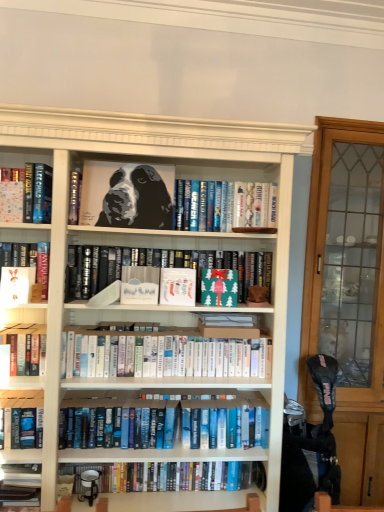
The image size is (384, 512). What do you see at coordinates (174, 201) in the screenshot?
I see `black matte portrait at upper center, which is the 7th book in bottom-to-top order` at bounding box center [174, 201].

Identify the location of white matte paper at left, the 4th paperback book in the right-to-left sequence. Image resolution: width=384 pixels, height=512 pixels. (16, 285).

The image size is (384, 512). What do you see at coordinates (21, 398) in the screenshot?
I see `hardcover book at lower left, the fifth book when ordered from top to bottom` at bounding box center [21, 398].

What is the approximate height of hardcover book at lower left, the fifth book when ordered from top to bottom?

hardcover book at lower left, the fifth book when ordered from top to bottom, is 9.60 inches in height.

Image resolution: width=384 pixels, height=512 pixels. Identify the location of hardcover book at left, which is the second book from top to bottom. (37, 193).

Locate an element on the screen. This screenshot has width=384, height=512. black matte portrait at upper center, which is the 7th book in bottom-to-top order is located at coordinates (174, 201).

Considering the positions of objects green paper at center, which is the 1th paperback book from right to left, and white matte paper at center, which is the third paperback book from left to right, in the image provided, who is more to the left, green paper at center, which is the 1th paperback book from right to left, or white matte paper at center, which is the third paperback book from left to right,?

From the viewer's perspective, white matte paper at center, which is the third paperback book from left to right, appears more on the left side.

You are a GUI agent. You are given a task and a screenshot of the screen. Output one action in this format:
    pyautogui.click(x=<x>, y=<y>)
    Task: Click on the 2nd paperback book behind the white matte paper at center, which is the third paperback book from left to right
    Image resolution: width=384 pixels, height=512 pixels.
    Given the screenshot: What is the action you would take?
    pyautogui.click(x=219, y=287)

Is green paper at center, which ranks as the fifth paperback book in left-to-right order, in front of white matte paper at center, which is the third paperback book from left to right?

No, it is behind white matte paper at center, which is the third paperback book from left to right.

Is green paper at center, which is the 1th paperback book from right to left, positioned with its back to white matte paper at center, the 3th paperback book positioned from the right?

No, green paper at center, which is the 1th paperback book from right to left,'s orientation is not away from white matte paper at center, the 3th paperback book positioned from the right.

From the picture: Between blue hardcover books at center, placed as the second book when sorted from bottom to top, and matte black book at center, placed as the 3th book when sorted from top to bottom, which one has less height?

Standing shorter between the two is blue hardcover books at center, placed as the second book when sorted from bottom to top.

Considering the relative sizes of blue hardcover books at center, which appears as the sixth book when viewed from the top, and matte black book at center, the 5th book in the bottom-to-top sequence, in the image provided, is blue hardcover books at center, which appears as the sixth book when viewed from the top, bigger than matte black book at center, the 5th book in the bottom-to-top sequence,?

Correct, blue hardcover books at center, which appears as the sixth book when viewed from the top, is larger in size than matte black book at center, the 5th book in the bottom-to-top sequence.

Is blue hardcover books at center, placed as the second book when sorted from bottom to top, at the right side of matte black book at center, the 5th book in the bottom-to-top sequence?

In fact, blue hardcover books at center, placed as the second book when sorted from bottom to top, is to the left of matte black book at center, the 5th book in the bottom-to-top sequence.

From the image's perspective, which is above, blue hardcover books at center, placed as the second book when sorted from bottom to top, or matte black book at center, placed as the 3th book when sorted from top to bottom?

matte black book at center, placed as the 3th book when sorted from top to bottom, appears higher in the image.

Are matte black book at center, the 5th book in the bottom-to-top sequence, and matte paper book at left, which ranks as the 1th paperback book in left-to-right order, beside each other?

There is a gap between matte black book at center, the 5th book in the bottom-to-top sequence, and matte paper book at left, which ranks as the 1th paperback book in left-to-right order.

Is matte black book at center, placed as the 3th book when sorted from top to bottom, turned away from matte paper book at left, placed as the fifth paperback book when sorted from right to left?

No, matte black book at center, placed as the 3th book when sorted from top to bottom, is not facing away from matte paper book at left, placed as the fifth paperback book when sorted from right to left.

Between matte black book at center, placed as the 3th book when sorted from top to bottom, and matte paper book at left, placed as the fifth paperback book when sorted from right to left, which one has smaller size?

With smaller size is matte paper book at left, placed as the fifth paperback book when sorted from right to left.

Can you confirm if matte black book at center, placed as the 3th book when sorted from top to bottom, is positioned to the right of matte paper book at left, placed as the fifth paperback book when sorted from right to left?

Indeed, matte black book at center, placed as the 3th book when sorted from top to bottom, is positioned on the right side of matte paper book at left, placed as the fifth paperback book when sorted from right to left.

Which of these two, clear glass cabinet at right or matte paper book at left, placed as the fifth paperback book when sorted from right to left, stands taller?

With more height is clear glass cabinet at right.

Considering the relative positions of clear glass cabinet at right and matte paper book at left, which ranks as the 1th paperback book in left-to-right order, in the image provided, is clear glass cabinet at right to the left of matte paper book at left, which ranks as the 1th paperback book in left-to-right order, from the viewer's perspective?

No, clear glass cabinet at right is not to the left of matte paper book at left, which ranks as the 1th paperback book in left-to-right order.

From a real-world perspective, is clear glass cabinet at right on matte paper book at left, placed as the fifth paperback book when sorted from right to left?

Incorrect, from a real-world perspective, clear glass cabinet at right is lower than matte paper book at left, placed as the fifth paperback book when sorted from right to left.

Can you confirm if blue hardcover books at lower center, the first book from the bottom, is shorter than matte paper stocking at center, the fourth paperback book viewed from the left?

In fact, blue hardcover books at lower center, the first book from the bottom, may be taller than matte paper stocking at center, the fourth paperback book viewed from the left.

From the image's perspective, is blue hardcover books at lower center, the first book from the bottom, on top of matte paper stocking at center, the fourth paperback book viewed from the left?

No, from the image's perspective, blue hardcover books at lower center, the first book from the bottom, is not above matte paper stocking at center, the fourth paperback book viewed from the left.

Are blue hardcover books at lower center, acting as the seventh book starting from the top, and matte paper stocking at center, acting as the second paperback book starting from the right, making contact?

blue hardcover books at lower center, acting as the seventh book starting from the top, is not next to matte paper stocking at center, acting as the second paperback book starting from the right, and they're not touching.

Considering the sizes of objects blue hardcover books at lower center, acting as the seventh book starting from the top, and matte paper stocking at center, the fourth paperback book viewed from the left, in the image provided, who is thinner, blue hardcover books at lower center, acting as the seventh book starting from the top, or matte paper stocking at center, the fourth paperback book viewed from the left,?

blue hardcover books at lower center, acting as the seventh book starting from the top.

From the image's perspective, which is below, black glossy painting of a dog at center or hardcover book at left, which is the second book from top to bottom?

hardcover book at left, which is the second book from top to bottom, is shown below in the image.

Considering the relative positions of black glossy painting of a dog at center and hardcover book at left, which is the second book from top to bottom, in the image provided, is black glossy painting of a dog at center to the left or to the right of hardcover book at left, which is the second book from top to bottom,?

black glossy painting of a dog at center is to the right of hardcover book at left, which is the second book from top to bottom.

What's the angular difference between black glossy painting of a dog at center and hardcover book at left, which is the second book from top to bottom,'s facing directions?

There is a 2.95-degree angle between the facing directions of black glossy painting of a dog at center and hardcover book at left, which is the second book from top to bottom.

Which object is further away from the camera taking this photo, black glossy painting of a dog at center or hardcover book at left, which is the sixth book from bottom to top?

black glossy painting of a dog at center is behind.

From the image's perspective, between matte black book at center, the 5th book in the bottom-to-top sequence, and white matte paper at center, which is the third paperback book from left to right, which one is located above?

matte black book at center, the 5th book in the bottom-to-top sequence.

Is the depth of matte black book at center, the 5th book in the bottom-to-top sequence, less than that of white matte paper at center, the 3th paperback book positioned from the right?

No, it is behind white matte paper at center, the 3th paperback book positioned from the right.

How much distance is there between matte black book at center, placed as the 3th book when sorted from top to bottom, and white matte paper at center, the 3th paperback book positioned from the right?

They are 6.93 inches apart.

Is point (79, 298) positioned after point (145, 278)?

Yes, point (79, 298) is behind point (145, 278).

The width and height of the screenshot is (384, 512). Identify the location of the 2nd paperback book behind the white matte paper at center, which is the third paperback book from left to right, starting your count from the anchor. (219, 287).

Where is `the 3rd book directly beneath the matte black book at center, the 5th book in the bottom-to-top sequence (from a real-world perspective)`? the 3rd book directly beneath the matte black book at center, the 5th book in the bottom-to-top sequence (from a real-world perspective) is located at coordinates (172, 422).

From the picture: When comparing their distances from black glossy painting of a dog at center, does clear glass cabinet at right or blue hardcover books at center, which appears as the sixth book when viewed from the top, seem closer?

blue hardcover books at center, which appears as the sixth book when viewed from the top, is positioned closer to the anchor black glossy painting of a dog at center.

When comparing their distances from black matte portrait at upper center, the first book positioned from the top, does hardcover book at lower left, the fifth book when ordered from top to bottom, or matte black book at center, placed as the 3th book when sorted from top to bottom, seem further?

hardcover book at lower left, the fifth book when ordered from top to bottom, lies further to black matte portrait at upper center, the first book positioned from the top, than the other object.

Estimate the real-world distances between objects in this image. Which object is closer to hardcover book at lower left, the fifth book when ordered from top to bottom, white matte paper at center, the 3th paperback book positioned from the right, or green paper at center, which ranks as the fifth paperback book in left-to-right order?

The object closer to hardcover book at lower left, the fifth book when ordered from top to bottom, is white matte paper at center, the 3th paperback book positioned from the right.

Considering their positions, is matte black book at center, the 5th book in the bottom-to-top sequence, positioned closer to clear glass cabinet at right than blue hardcover books at lower center, the first book from the bottom?

Among the two, matte black book at center, the 5th book in the bottom-to-top sequence, is located nearer to clear glass cabinet at right.

Estimate the real-world distances between objects in this image. Which object is further from clear glass cabinet at right, matte paper stocking at center, acting as the second paperback book starting from the right, or blue hardcover books at center, which appears as the sixth book when viewed from the top?

The object further to clear glass cabinet at right is matte paper stocking at center, acting as the second paperback book starting from the right.

Estimate the real-world distances between objects in this image. Which object is further from blue hardcover books at lower center, the first book from the bottom, blue hardcover books at center, placed as the second book when sorted from bottom to top, or white matte paper at left, the 4th paperback book in the right-to-left sequence?

white matte paper at left, the 4th paperback book in the right-to-left sequence, is positioned further to the anchor blue hardcover books at lower center, the first book from the bottom.

When comparing their distances from hardcover book at left, which is the sixth book from bottom to top, does white matte paper at center, which is the third paperback book from left to right, or blue hardcover books at lower center, the first book from the bottom, seem closer?

white matte paper at center, which is the third paperback book from left to right, lies closer to hardcover book at left, which is the sixth book from bottom to top, than the other object.

Looking at the image, which one is located closer to matte paper book at left, which ranks as the 1th paperback book in left-to-right order, blue hardcover books at lower center, the first book from the bottom, or white matte paper at center, which is the third paperback book from left to right?

white matte paper at center, which is the third paperback book from left to right.

What are the coordinates of `paperback book between white matte paper at left, the second paperback book positioned from the left, and white paperbacks at center, the 4th book positioned from the bottom, from left to right` in the screenshot? It's located at (140, 285).

Image resolution: width=384 pixels, height=512 pixels. What are the coordinates of `paperback book between white matte paper at left, the 4th paperback book in the right-to-left sequence, and matte paper stocking at center, acting as the second paperback book starting from the right, in the horizontal direction` in the screenshot? It's located at (140, 285).

The width and height of the screenshot is (384, 512). Identify the location of dog between white matte paper at left, the second paperback book positioned from the left, and green paper at center, which is the 1th paperback book from right to left, in the horizontal direction. (136, 200).

The height and width of the screenshot is (512, 384). I want to click on paperback book between matte paper stocking at center, acting as the second paperback book starting from the right, and blue hardcover books at lower center, the first book from the bottom, in the vertical direction, so click(x=219, y=287).